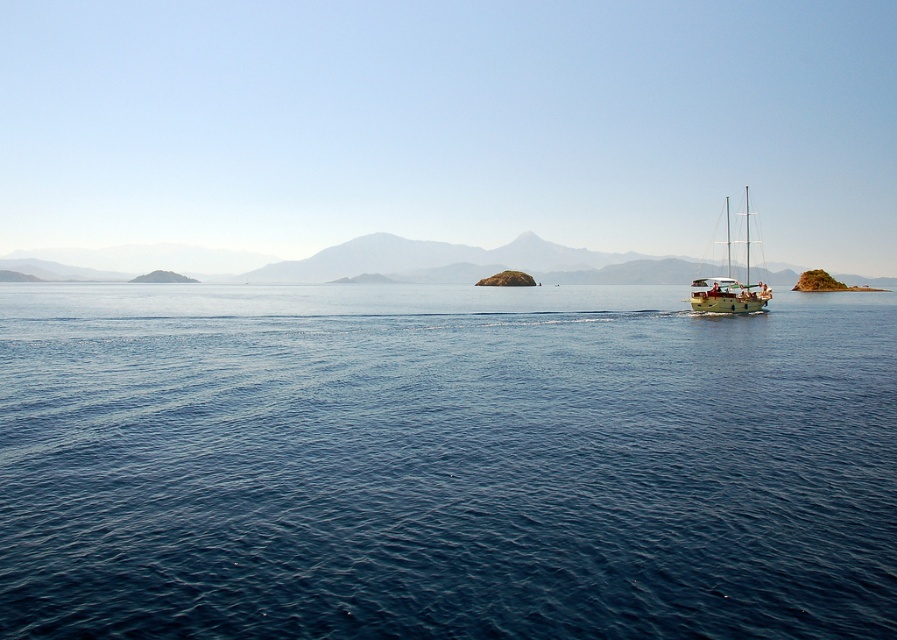
You are standing on the deck of the sailboat and looking out at the two points marked in the scene. Which point is closer to you, point (91, 353) or point (240, 268)?

Point (91, 353) is in front of point (240, 268), so it is closer to you.

You are a drone operator who needs to fly a drone between the blue water at center and the rocky brown mountain at center. The drone has a maximum flight distance of 450 feet. Can the drone safely make the trip without needing to recharge?

The blue water at center and rocky brown mountain at center are 472.37 feet apart from each other. Since the distance exceeds the drone maximum flight distance of 450 feet, the drone cannot safely make the trip without needing to recharge.

You are a sailor navigating a boat and see the point marked at coordinates (x=443, y=464) in the image. Based on the scene description, what type of terrain is located at that point?

The point at coordinates (x=443, y=464) is on blue water at center, so the terrain there is water.